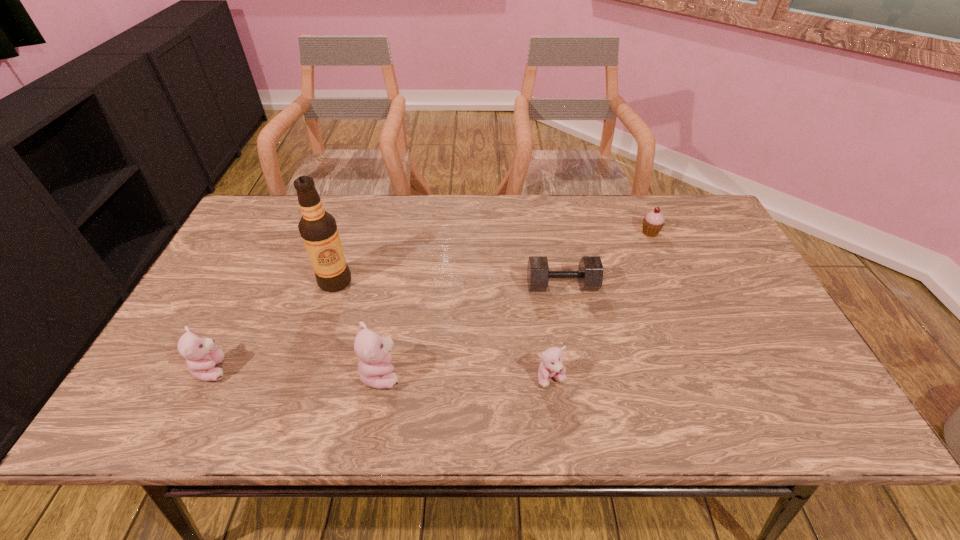
At what (x,y) coordinates should I click in order to perform the action: click on the leftmost object. Please return your answer as a coordinate pair (x, y). Looking at the image, I should click on (201, 354).

At what (x,y) coordinates should I click in order to perform the action: click on the second tallest teddy bear. Please return your answer as a coordinate pair (x, y). This screenshot has width=960, height=540. Looking at the image, I should click on (201, 354).

Where is `the fourth object from right to left`? Image resolution: width=960 pixels, height=540 pixels. the fourth object from right to left is located at coordinates (375, 369).

This screenshot has height=540, width=960. Find the location of `the tallest teddy bear`. the tallest teddy bear is located at coordinates (375, 369).

At what (x,y) coordinates should I click in order to perform the action: click on the shortest teddy bear. Please return your answer as a coordinate pair (x, y). This screenshot has height=540, width=960. Looking at the image, I should click on (551, 366).

The width and height of the screenshot is (960, 540). Find the location of `cupcake`. cupcake is located at coordinates (653, 222).

I want to click on the farthest object, so click(x=653, y=222).

The height and width of the screenshot is (540, 960). Identify the location of dumbbell. (590, 270).

The image size is (960, 540). I want to click on the fifth object from right to left, so click(x=318, y=229).

Locate an element on the screen. the tallest object is located at coordinates (318, 229).